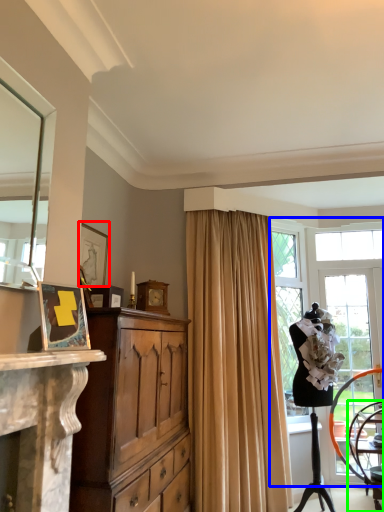
Question: Which is nearer to the picture frame (highlighted by a red box)? window (highlighted by a blue box) or chair (highlighted by a green box).

Choices:
 (A) window
 (B) chair

Answer: (A)